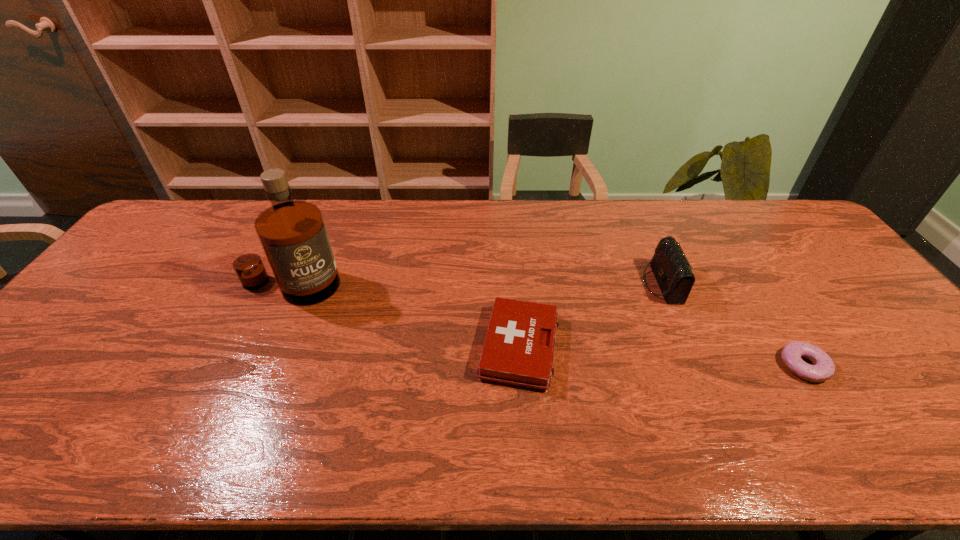
The height and width of the screenshot is (540, 960). In order to click on free spot that satisfies the following two spatial constraints: 1. on the front side of the doughnut; 2. on the left side of the third object from right to left in this screenshot , I will do coord(520,366).

In order to click on vacant space that satisfies the following two spatial constraints: 1. on the front flap of the clutch bag; 2. on the front label of the liquor in this screenshot , I will do `click(663, 286)`.

This screenshot has height=540, width=960. I want to click on free space that satisfies the following two spatial constraints: 1. on the front side of the third object from right to left; 2. on the left side of the rightmost object, so click(520, 366).

Find the location of a particular element. free location that satisfies the following two spatial constraints: 1. on the front label of the second shortest object; 2. on the left side of the leftmost object is located at coordinates pyautogui.click(x=263, y=347).

Locate an element on the screen. This screenshot has width=960, height=540. free location that satisfies the following two spatial constraints: 1. on the front flap of the third shortest object; 2. on the front label of the liquor is located at coordinates (663, 286).

Locate an element on the screen. The width and height of the screenshot is (960, 540). free spot that satisfies the following two spatial constraints: 1. on the front flap of the clutch bag; 2. on the right side of the doughnut is located at coordinates [x=698, y=366].

Where is `free space that satisfies the following two spatial constraints: 1. on the front flap of the clutch bag; 2. on the front label of the leftmost object`? This screenshot has height=540, width=960. free space that satisfies the following two spatial constraints: 1. on the front flap of the clutch bag; 2. on the front label of the leftmost object is located at coordinates (663, 286).

Find the location of a particular element. vacant point that satisfies the following two spatial constraints: 1. on the front label of the tallest object; 2. on the right side of the first-aid kit is located at coordinates (263, 347).